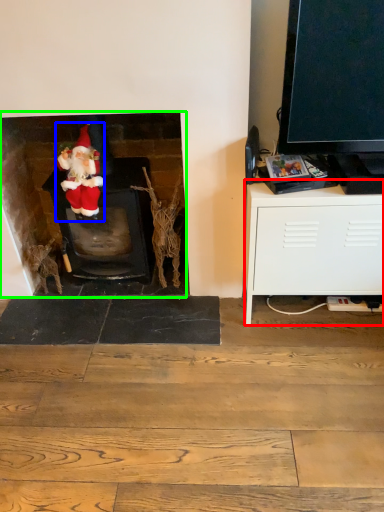
Question: Estimate the real-world distances between objects in this image. Which object is closer to cabinetry (highlighted by a red box), person (highlighted by a blue box) or fireplace (highlighted by a green box)?

Choices:
 (A) person
 (B) fireplace

Answer: (B)